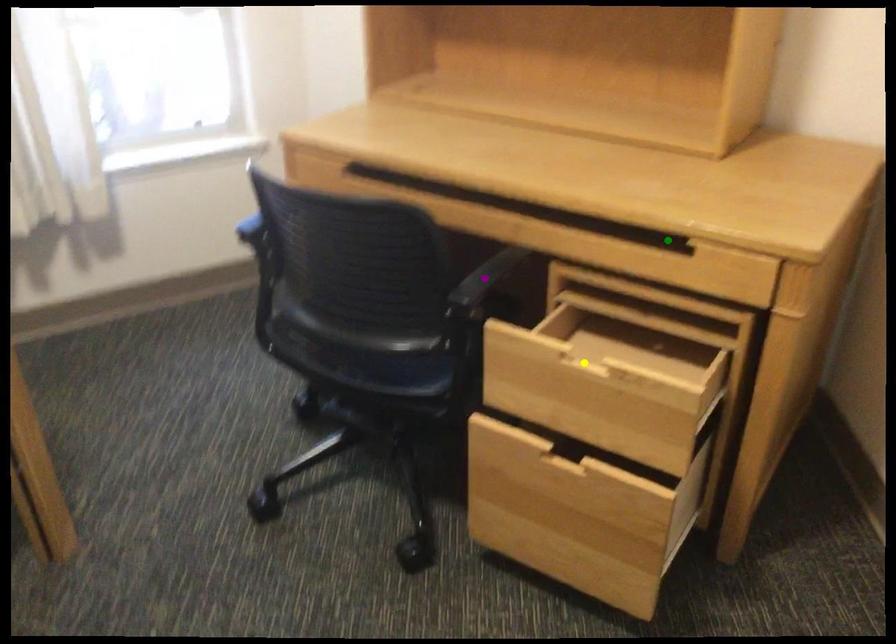
Order these from nearest to farthest:
yellow point, purple point, green point

yellow point < green point < purple point